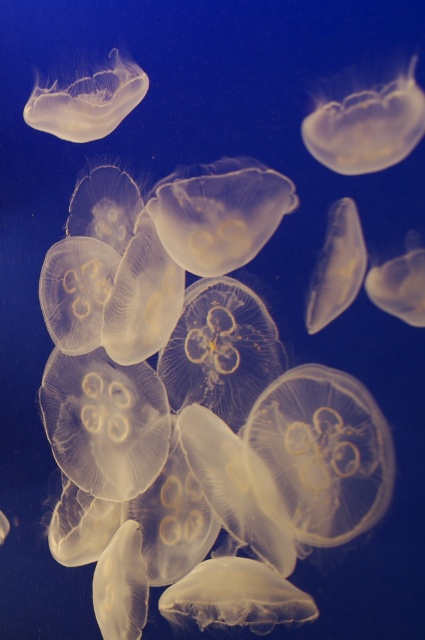
You are an underwater photographer aiming to capture the translucent gelatinous at upper center and the translucent gelatinous at center in the same frame. Which one appears bigger in your camera viewfinder?

The translucent gelatinous at upper center appears bigger in the camera viewfinder because it has a larger size compared to the translucent gelatinous at center.

You are an underwater photographer aiming to capture the intricate patterns of the jellyfish. You notice a specific point at coordinates point (367, 125). What object is this point located on?

The point (367, 125) is located on the translucent gelatinous at upper center.

You are an underwater photographer trying to capture a photo of the translucent gelatinous at upper center and the translucent gelatinous at upper left. Based on their positions, which one do you think will appear closer to the camera in the photo?

The translucent gelatinous at upper center is below the translucent gelatinous at upper left, so it will appear closer to the camera in the photo.